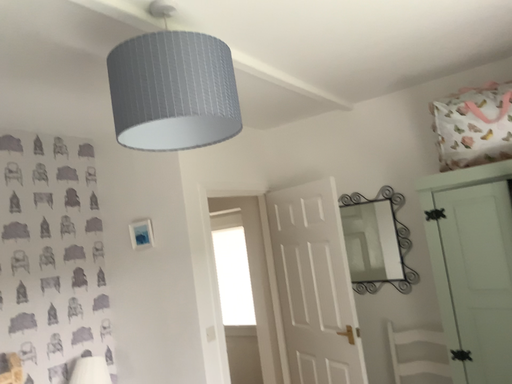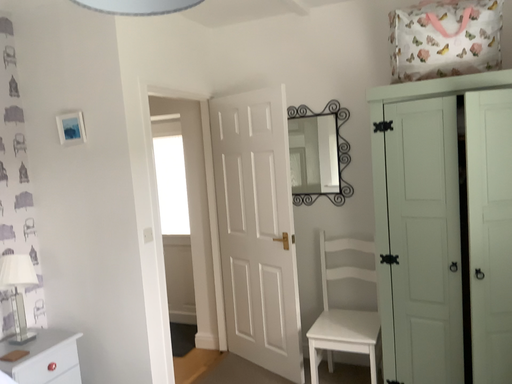
Question: How did the camera likely rotate when shooting the video?

Choices:
 (A) rotated downward
 (B) rotated upward

Answer: (A)